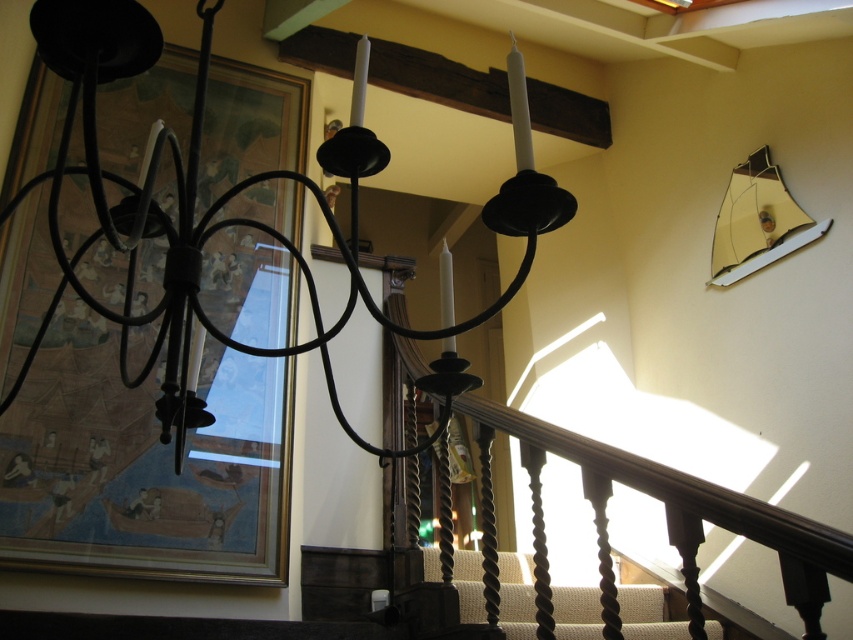
Question: Which of the following is the farthest from the observer?

Choices:
 (A) (109, 8)
 (B) (585, 595)

Answer: (B)

Question: Is matte black chandelier at upper center above gold mirrored sailboat at upper right?

Choices:
 (A) yes
 (B) no

Answer: (B)

Question: Which point is closer to the camera taking this photo?

Choices:
 (A) (102, 392)
 (B) (659, 630)
 (C) (183, 355)
 (D) (744, 177)

Answer: (C)

Question: Among these objects, which one is farthest from the camera?

Choices:
 (A) dark wood stair at center
 (B) matte black chandelier at upper center
 (C) gold mirrored sailboat at upper right

Answer: (C)

Question: Is wooden framed picture at upper left below dark wood stair at center?

Choices:
 (A) no
 (B) yes

Answer: (A)

Question: Does wooden framed picture at upper left come in front of dark wood stair at center?

Choices:
 (A) yes
 (B) no

Answer: (B)